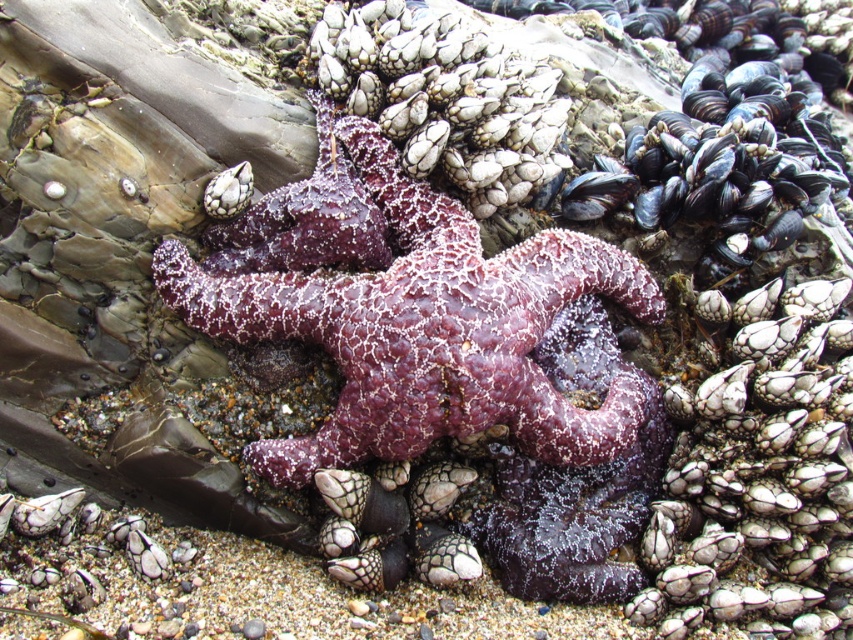
Question: Among these objects, which one is nearest to the camera?

Choices:
 (A) purple rough starfish at center
 (B) purple matte starfish at center

Answer: (B)

Question: Does purple matte starfish at center appear on the right side of purple rough starfish at center?

Choices:
 (A) no
 (B) yes

Answer: (B)

Question: Is purple matte starfish at center wider than purple rough starfish at center?

Choices:
 (A) yes
 (B) no

Answer: (A)

Question: Observing the image, what is the correct spatial positioning of purple matte starfish at center in reference to purple rough starfish at center?

Choices:
 (A) right
 (B) left

Answer: (A)